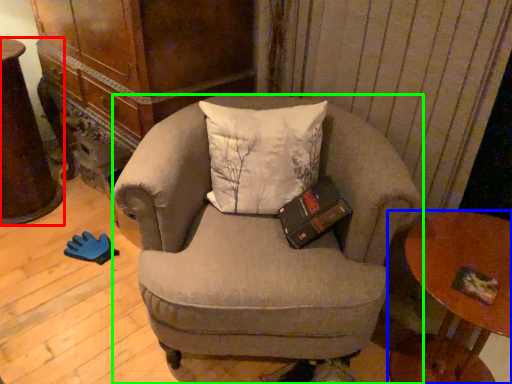
Question: Which object is the closest to the desk (highlighted by a red box)? Choose among these: table (highlighted by a blue box) or chair (highlighted by a green box).

Choices:
 (A) table
 (B) chair

Answer: (B)